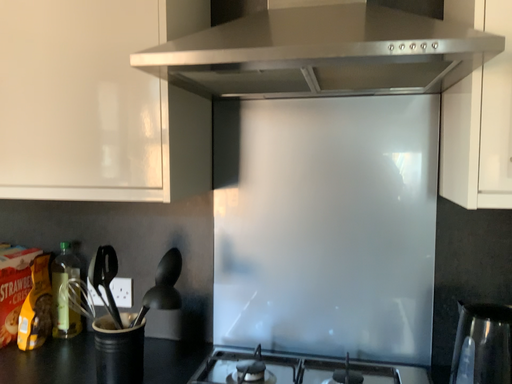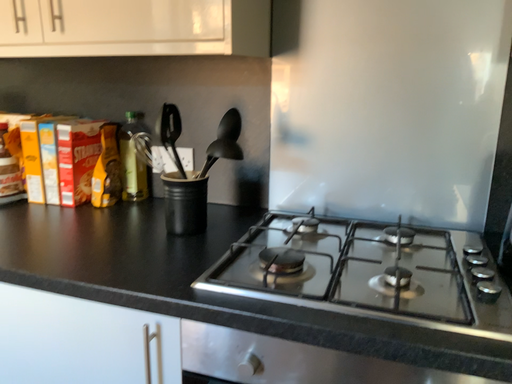
Question: How did the camera likely rotate when shooting the video?

Choices:
 (A) rotated upward
 (B) rotated downward

Answer: (B)